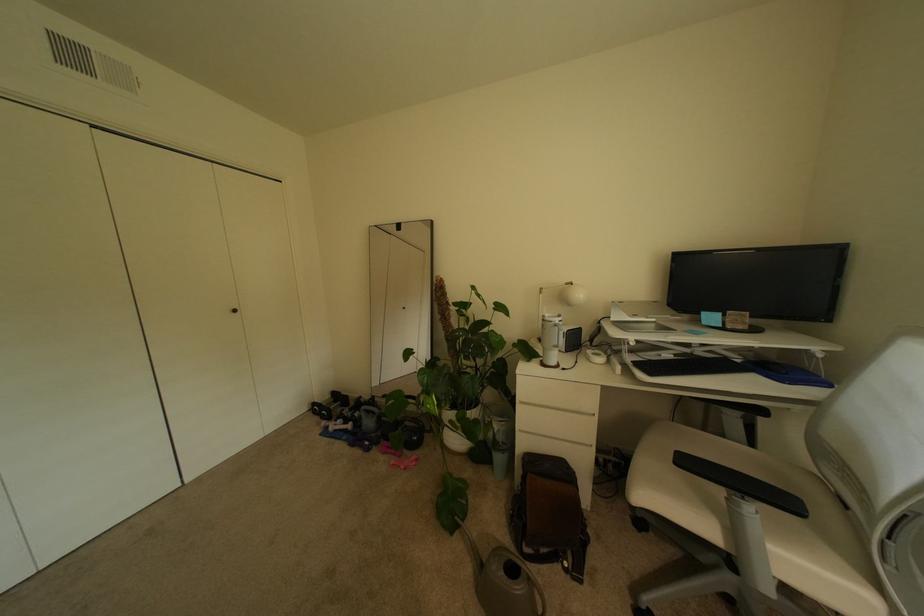
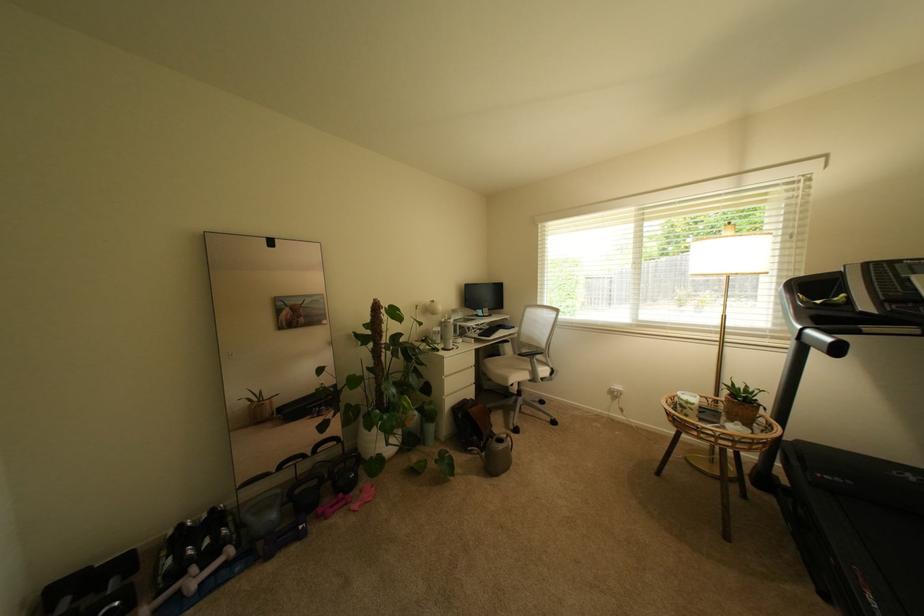
Locate, in the second image, the point that corresponds to point 416,453 in the first image.

(359, 495)